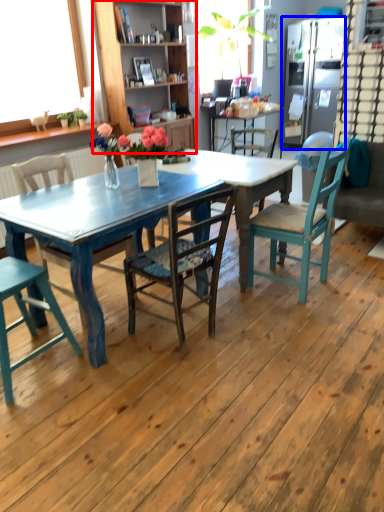
Question: Which object appears closest to the camera in this image, cabinetry (highlighted by a red box) or refrigerator (highlighted by a blue box)?

Choices:
 (A) cabinetry
 (B) refrigerator

Answer: (A)